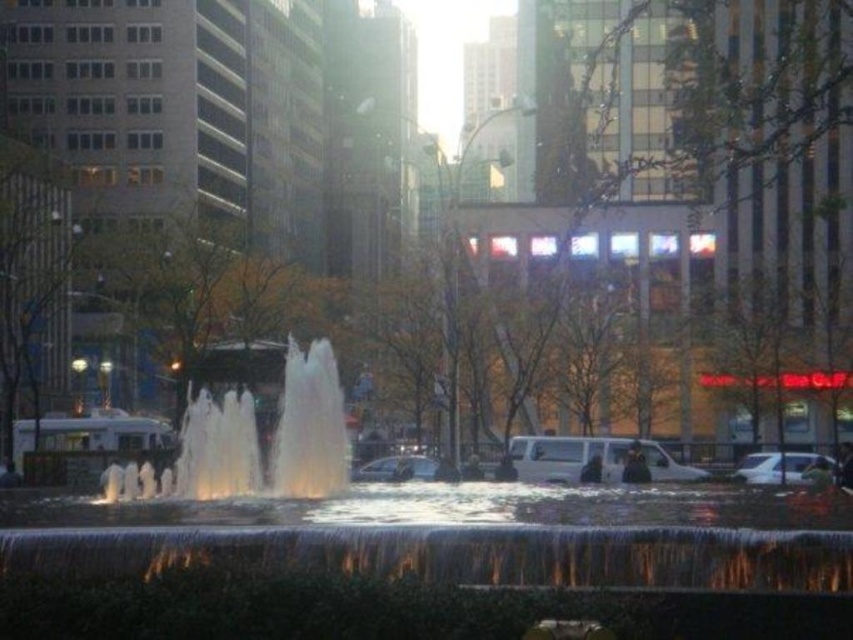
Question: Which point is closer to the camera?

Choices:
 (A) clear water at center
 (B) white matte van at center

Answer: (A)

Question: Based on their relative distances, which object is farther from the clear water at center?

Choices:
 (A) white glossy car at lower right
 (B) shiny silver car at center
 (C) white matte van at center

Answer: (C)

Question: Considering the relative positions of white matte van at center and white glossy car at lower right in the image provided, where is white matte van at center located with respect to white glossy car at lower right?

Choices:
 (A) above
 (B) below

Answer: (A)

Question: Among these points, which one is nearest to the camera?

Choices:
 (A) (329, 483)
 (B) (646, 464)
 (C) (819, 458)
 (D) (375, 464)

Answer: (A)

Question: Is clear water at center positioned in front of shiny silver car at center?

Choices:
 (A) yes
 (B) no

Answer: (A)

Question: Can you confirm if clear water at center is positioned to the left of white matte van at center?

Choices:
 (A) no
 (B) yes

Answer: (B)